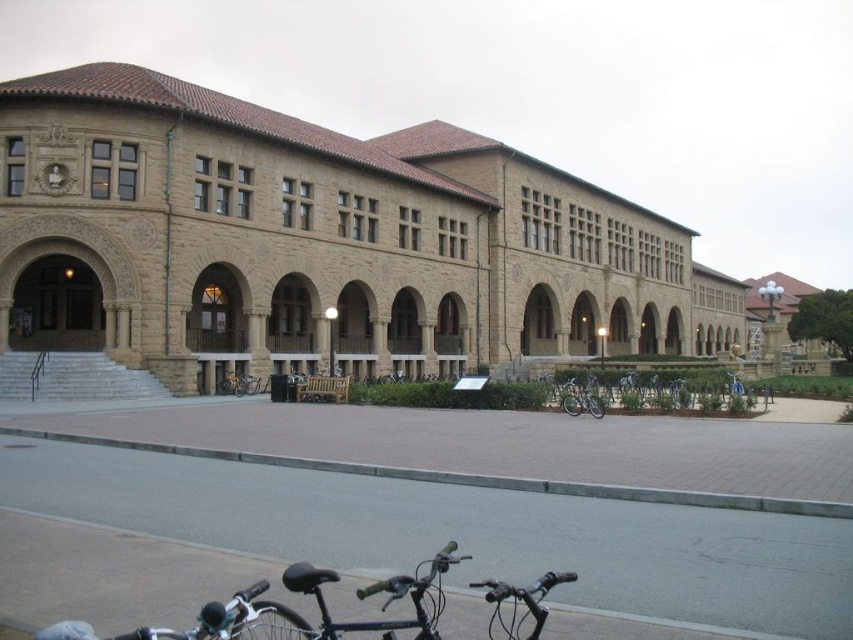
Question: Does gray concrete curb at lower center appear over shiny metallic bicycle at center?

Choices:
 (A) no
 (B) yes

Answer: (A)

Question: Which point appears farthest from the camera in this image?

Choices:
 (A) (733, 380)
 (B) (573, 403)

Answer: (A)

Question: Is gray concrete curb at lower center wider than shiny metallic bicycle at center?

Choices:
 (A) yes
 (B) no

Answer: (A)

Question: Does shiny metallic bicycle at center-right appear under blue metallic bicycle at center?

Choices:
 (A) yes
 (B) no

Answer: (A)

Question: Which point appears farthest from the camera in this image?

Choices:
 (A) (264, 460)
 (B) (579, 387)
 (C) (730, 378)

Answer: (C)

Question: Which point is closer to the camera?

Choices:
 (A) (567, 394)
 (B) (253, 387)
 (C) (364, 467)

Answer: (C)